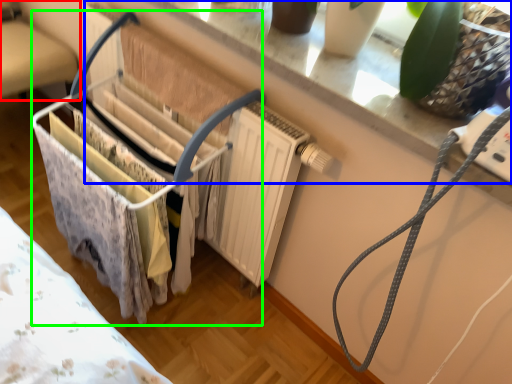
Question: Which object is positioned farthest from furniture (highlighted by a red box)? Select from window sill (highlighted by a blue box) and baby carriage (highlighted by a green box).

Choices:
 (A) window sill
 (B) baby carriage

Answer: (A)